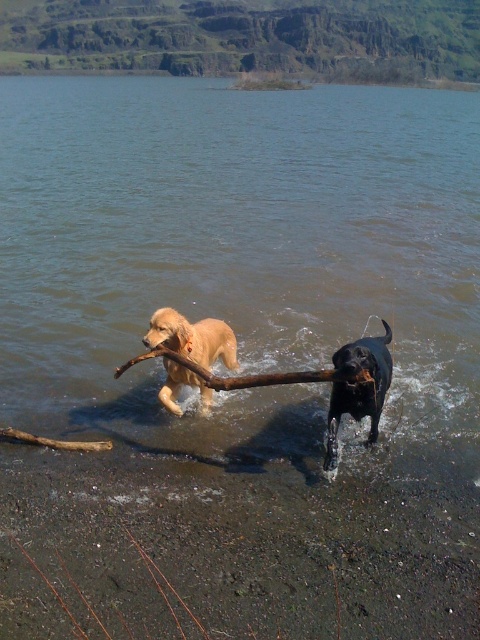
Question: Among these points, which one is farthest from the camera?

Choices:
 (A) (367, 170)
 (B) (324, 372)
 (C) (159, 332)

Answer: (A)

Question: Estimate the real-world distances between objects in this image. Which object is closer to the shiny black dog at center?

Choices:
 (A) brown wood branch at center
 (B) brown matte water at center

Answer: (A)

Question: Is shiny black dog at center closer to the viewer compared to brown wood branch at center?

Choices:
 (A) no
 (B) yes

Answer: (B)

Question: Does golden fur dog at center appear under brown wood branch at center?

Choices:
 (A) no
 (B) yes

Answer: (B)

Question: Can you confirm if golden fur dog at center is bigger than shiny black dog at center?

Choices:
 (A) no
 (B) yes

Answer: (A)

Question: Which point is closer to the camera?

Choices:
 (A) brown wood branch at center
 (B) shiny black dog at center
 (C) brown matte water at center

Answer: (B)